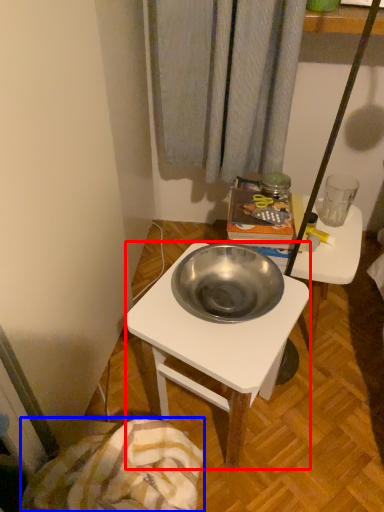
Question: Which of the following is the farthest to the observer, desk (highlighted by a red box) or blanket (highlighted by a blue box)?

Choices:
 (A) desk
 (B) blanket

Answer: (A)